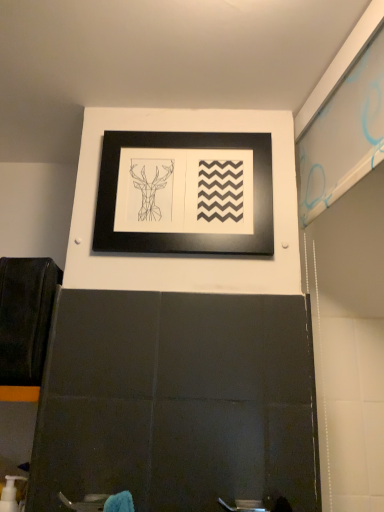
The height and width of the screenshot is (512, 384). What do you see at coordinates (11, 495) in the screenshot?
I see `white plastic pump at lower left` at bounding box center [11, 495].

The width and height of the screenshot is (384, 512). What are the coordinates of `white plastic pump at lower left` in the screenshot? It's located at (11, 495).

The height and width of the screenshot is (512, 384). Describe the element at coordinates (185, 193) in the screenshot. I see `black matte picture frame at upper center` at that location.

Measure the distance between black matte picture frame at upper center and camera.

The depth of black matte picture frame at upper center is 33.66 inches.

The width and height of the screenshot is (384, 512). I want to click on black matte picture frame at upper center, so click(x=185, y=193).

Where is `white plastic pump at lower left`? This screenshot has width=384, height=512. white plastic pump at lower left is located at coordinates (11, 495).

Visually, is white plastic pump at lower left positioned to the left or to the right of black matte picture frame at upper center?

Clearly, white plastic pump at lower left is on the left of black matte picture frame at upper center in the image.

Which is in front, white plastic pump at lower left or black matte picture frame at upper center?

white plastic pump at lower left is in front.

Considering the positions of points (9, 483) and (105, 151), is point (9, 483) farther from camera compared to point (105, 151)?

No, it is in front of (105, 151).

From the image's perspective, is white plastic pump at lower left above or below black matte picture frame at upper center?

Clearly, from the image's perspective, white plastic pump at lower left is below black matte picture frame at upper center.

From a real-world perspective, which object stands above the other?

black matte picture frame at upper center.

In terms of width, does white plastic pump at lower left look wider or thinner when compared to black matte picture frame at upper center?

white plastic pump at lower left is wider than black matte picture frame at upper center.

Considering the relative sizes of white plastic pump at lower left and black matte picture frame at upper center in the image provided, is white plastic pump at lower left shorter than black matte picture frame at upper center?

Yes, white plastic pump at lower left is shorter than black matte picture frame at upper center.

Does white plastic pump at lower left have a smaller size compared to black matte picture frame at upper center?

Yes, white plastic pump at lower left is smaller than black matte picture frame at upper center.

Choose the correct answer: Is white plastic pump at lower left inside black matte picture frame at upper center or outside it?

white plastic pump at lower left lies outside black matte picture frame at upper center.

Is white plastic pump at lower left far away from black matte picture frame at upper center?

white plastic pump at lower left is actually quite close to black matte picture frame at upper center.

Is white plastic pump at lower left looking in the opposite direction of black matte picture frame at upper center?

No, white plastic pump at lower left's orientation is not away from black matte picture frame at upper center.

Looking at this image, how distant is white plastic pump at lower left from black matte picture frame at upper center?

A distance of 25.75 inches exists between white plastic pump at lower left and black matte picture frame at upper center.

You are a GUI agent. You are given a task and a screenshot of the screen. Output one action in this format:
    pyautogui.click(x=<x>, y=<y>)
    Task: Click on the toiletry located in front of the black matte picture frame at upper center
    This screenshot has height=512, width=384.
    Given the screenshot: What is the action you would take?
    pyautogui.click(x=11, y=495)

Which object is positioned more to the right, black matte picture frame at upper center or white plastic pump at lower left?

black matte picture frame at upper center.

Is black matte picture frame at upper center in front of white plastic pump at lower left?

No, the depth of black matte picture frame at upper center is greater than that of white plastic pump at lower left.

Considering the points (205, 197) and (9, 510), which point is in front, point (205, 197) or point (9, 510)?

Positioned in front is point (9, 510).

From the image's perspective, relative to white plastic pump at lower left, is black matte picture frame at upper center above or below?

black matte picture frame at upper center is situated higher than white plastic pump at lower left in the image.

From a real-world perspective, between black matte picture frame at upper center and white plastic pump at lower left, who is vertically lower?

white plastic pump at lower left is physically lower.

Between black matte picture frame at upper center and white plastic pump at lower left, which one has smaller width?

Thinner between the two is black matte picture frame at upper center.

Considering the sizes of objects black matte picture frame at upper center and white plastic pump at lower left in the image provided, who is taller, black matte picture frame at upper center or white plastic pump at lower left?

black matte picture frame at upper center is taller.

Between black matte picture frame at upper center and white plastic pump at lower left, which one has smaller size?

Smaller between the two is white plastic pump at lower left.

Is black matte picture frame at upper center inside or outside of white plastic pump at lower left?

black matte picture frame at upper center lies outside white plastic pump at lower left.

Is black matte picture frame at upper center next to white plastic pump at lower left?

black matte picture frame at upper center and white plastic pump at lower left are not in contact.

Is black matte picture frame at upper center facing away from white plastic pump at lower left?

No, white plastic pump at lower left is not at the back of black matte picture frame at upper center.

Based on the photo, how different are the orientations of black matte picture frame at upper center and white plastic pump at lower left in degrees?

The angle between the facing direction of black matte picture frame at upper center and the facing direction of white plastic pump at lower left is 2.83 degrees.

How distant is black matte picture frame at upper center from white plastic pump at lower left?

The distance of black matte picture frame at upper center from white plastic pump at lower left is 65.39 centimeters.

The height and width of the screenshot is (512, 384). In order to click on picture frame that appears behind the white plastic pump at lower left in this screenshot , I will do `click(185, 193)`.

The image size is (384, 512). What are the coordinates of `toiletry below the black matte picture frame at upper center (from a real-world perspective)` in the screenshot? It's located at (11, 495).

Find the location of a particular element. This screenshot has width=384, height=512. toiletry below the black matte picture frame at upper center (from the image's perspective) is located at coordinates 11,495.